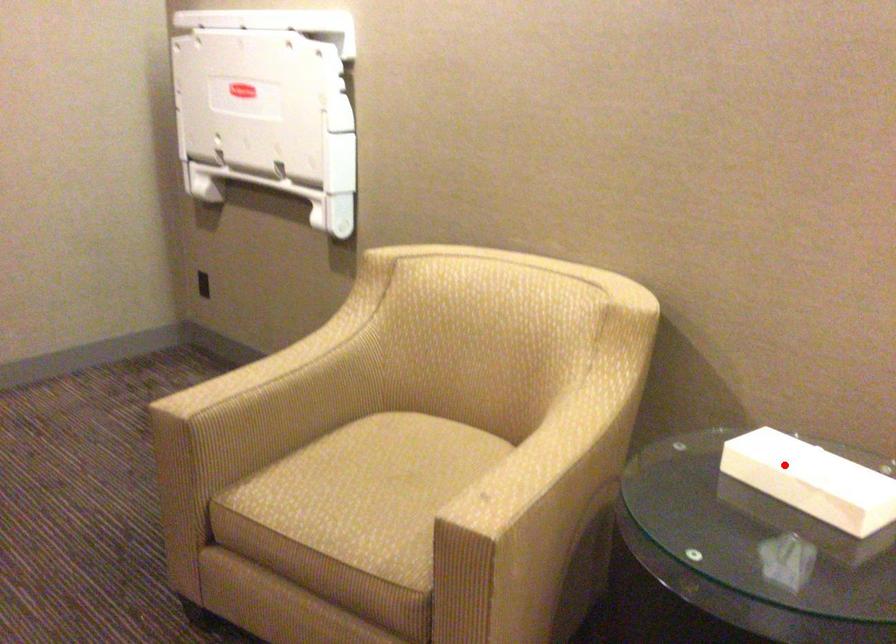
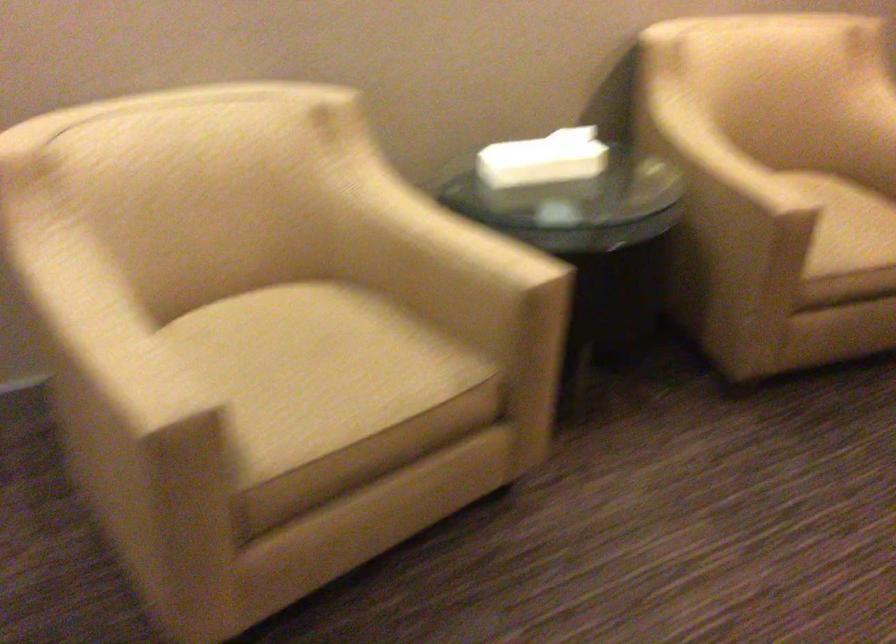
The point at the highlighted location is marked in the first image. Where is the corresponding point in the second image?

(543, 158)